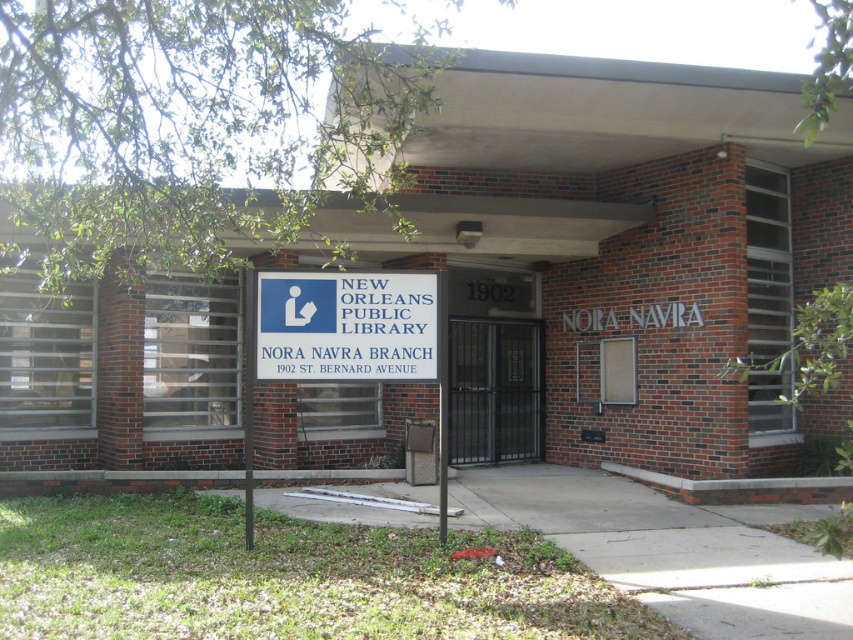
You are a visitor approaching the entrance of the library and see the blue plastic sign at center and the metallic gate at center. Which object is taller?

The metallic gate at center is taller than the blue plastic sign at center.